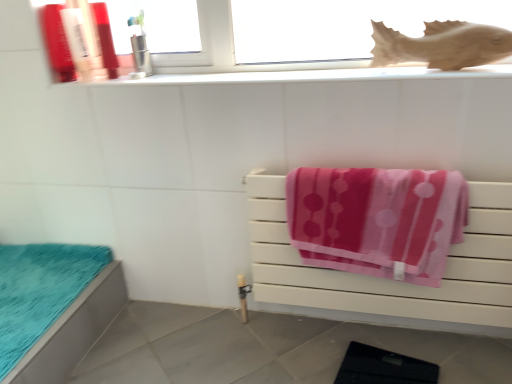
Image resolution: width=512 pixels, height=384 pixels. I want to click on unoccupied region to the right of metallic toothbrush holder at upper left, marked as the first toiletry in a right-to-left arrangement, so click(x=189, y=71).